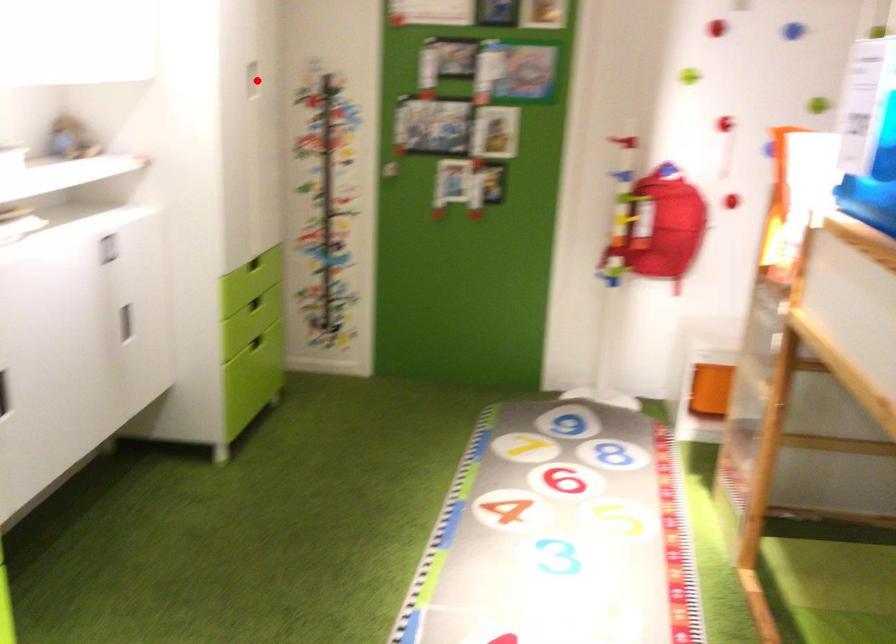
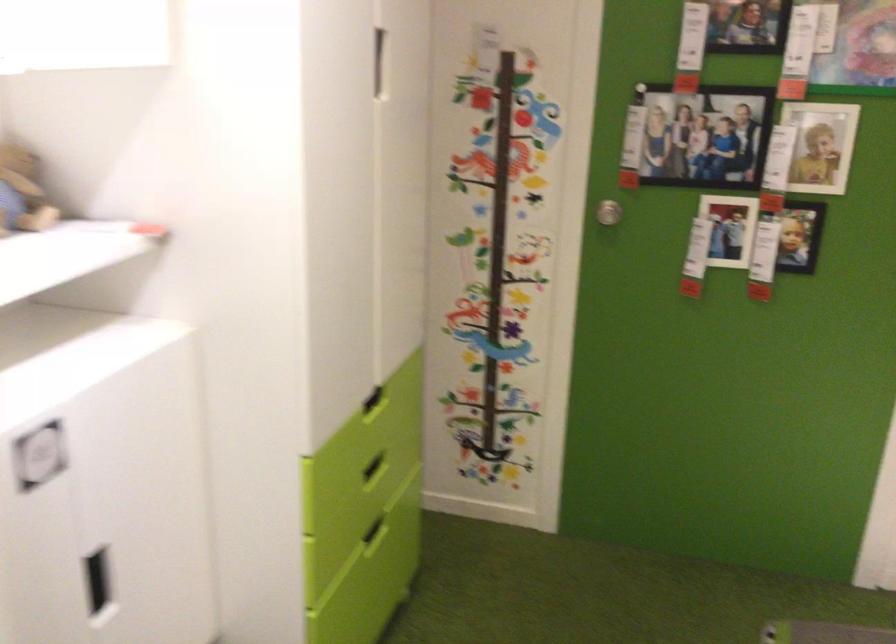
Question: A red point is marked in image1. In image2, is the corresponding 3D point closer to the camera or farther? Reply with the corresponding letter.

Choices:
 (A) The corresponding 3D point is closer.
 (B) The corresponding 3D point is farther.

Answer: (A)